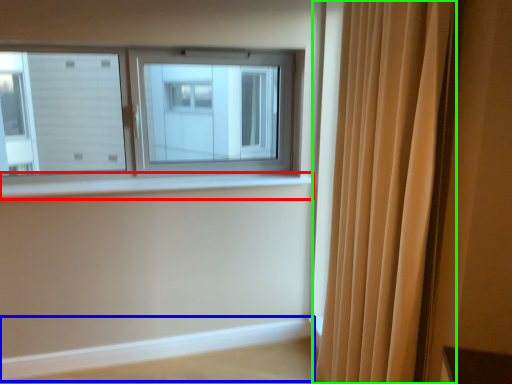
Question: Which object is positioned farthest from window sill (highlighted by a red box)? Select from ledge (highlighted by a blue box) and curtain (highlighted by a green box).

Choices:
 (A) ledge
 (B) curtain

Answer: (B)